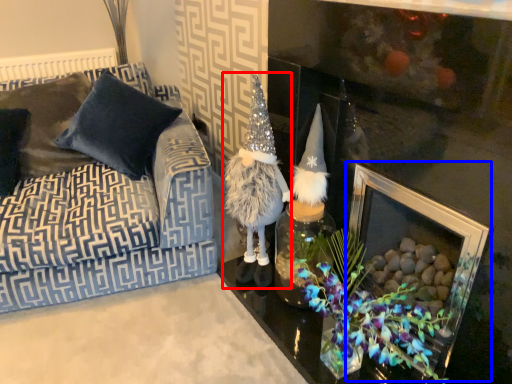
Question: Among these objects, which one is nearest to the camera, figurine (highlighted by a red box) or picture frame (highlighted by a blue box)?

Choices:
 (A) figurine
 (B) picture frame

Answer: (B)